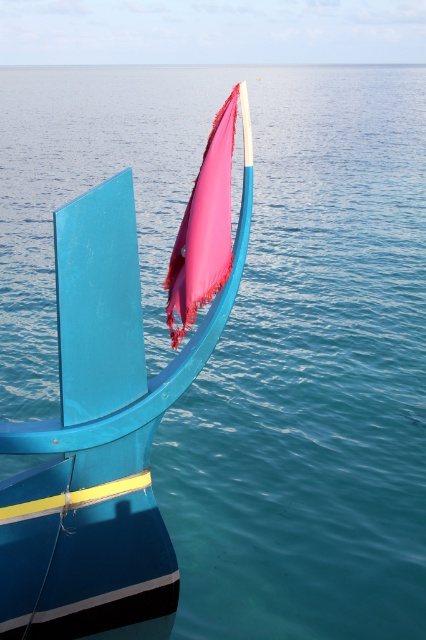
Question: Which point is closer to the camera taking this photo?

Choices:
 (A) (111, 296)
 (B) (192, 188)

Answer: (A)

Question: Is matte blue boat at center to the right of pink fabric flag at center from the viewer's perspective?

Choices:
 (A) yes
 (B) no

Answer: (B)

Question: Does matte blue boat at center appear over pink fabric flag at center?

Choices:
 (A) no
 (B) yes

Answer: (A)

Question: Does matte blue boat at center have a greater width compared to pink fabric flag at center?

Choices:
 (A) yes
 (B) no

Answer: (A)